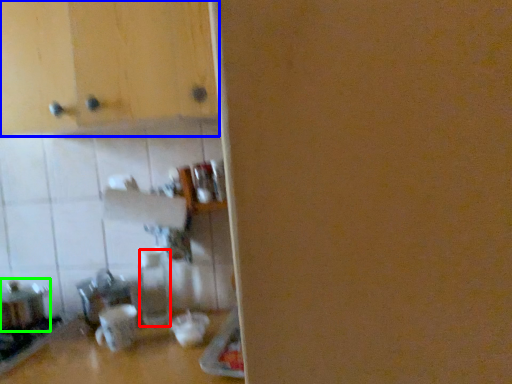
Question: Considering the real-world distances, which object is farthest from bottle (highlighted by a red box)? cabinetry (highlighted by a blue box) or appliance (highlighted by a green box)?

Choices:
 (A) cabinetry
 (B) appliance

Answer: (A)